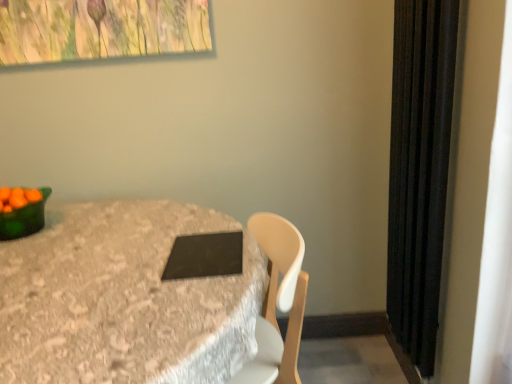
Question: Looking at their shapes, would you say green matte bowl at left is wider or thinner than black matte pad at center?

Choices:
 (A) thin
 (B) wide

Answer: (A)

Question: From the image's perspective, relative to black matte pad at center, is green matte bowl at left above or below?

Choices:
 (A) below
 (B) above

Answer: (B)

Question: Which of these objects is positioned farthest from the green matte bowl at left?

Choices:
 (A) green glossy bowl at left
 (B) black matte pad at center
 (C) matte black tablet at center

Answer: (B)

Question: Based on their relative distances, which object is nearer to the black matte pad at center?

Choices:
 (A) green glossy bowl at left
 (B) matte black tablet at center
 (C) green matte bowl at left

Answer: (B)